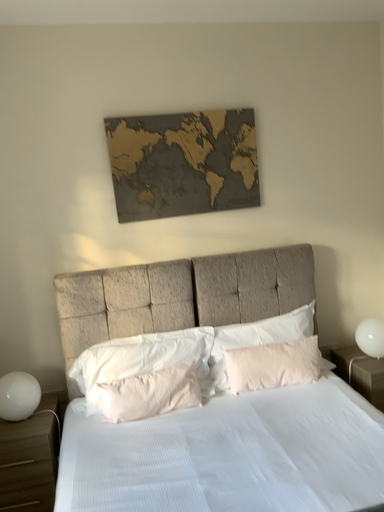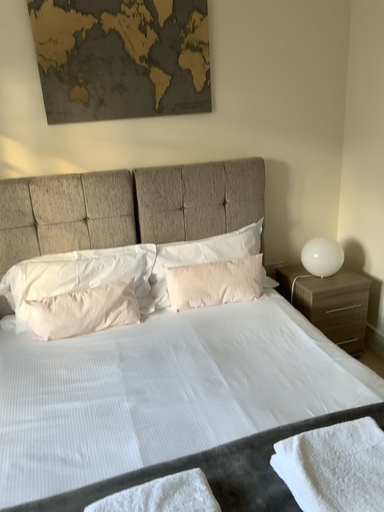
Question: How did the camera likely rotate when shooting the video?

Choices:
 (A) rotated downward
 (B) rotated upward

Answer: (A)